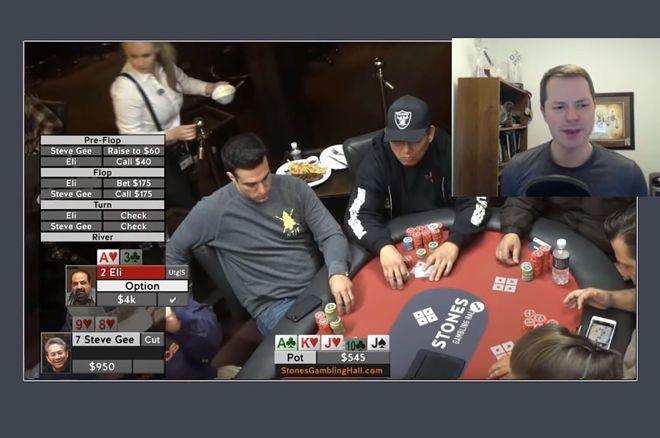
At what (x,y) coordinates should I click in order to perform the action: click on picture frame. Please return your answer as a coordinate pair (x, y). This screenshot has width=660, height=438. Looking at the image, I should click on (618, 119).